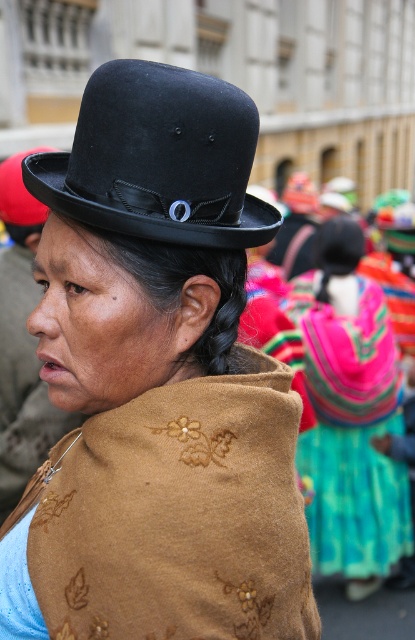
Between point (197, 172) and point (337, 365), which one is positioned behind?

The point (337, 365) is more distant.

This screenshot has width=415, height=640. Identify the location of black felt hat at upper center. (158, 160).

Is matte black hat at upper center positioned in front of black felt hat at upper center?

That is True.

Which is in front, point (38, 184) or point (214, 236)?

Point (214, 236)

You are a GUI agent. You are given a task and a screenshot of the screen. Output one action in this format:
    pyautogui.click(x=<x>, y=<y>)
    Task: Click on the matte black hat at upper center
    This screenshot has width=415, height=640.
    Given the screenshot: What is the action you would take?
    pyautogui.click(x=158, y=380)

Between matte black hat at upper center and multicolored woven skirt at center, which one is positioned lower?

multicolored woven skirt at center is lower down.

Is point (39, 253) closer to camera compared to point (366, 525)?

Yes, it is.

I want to click on matte black hat at upper center, so (x=158, y=380).